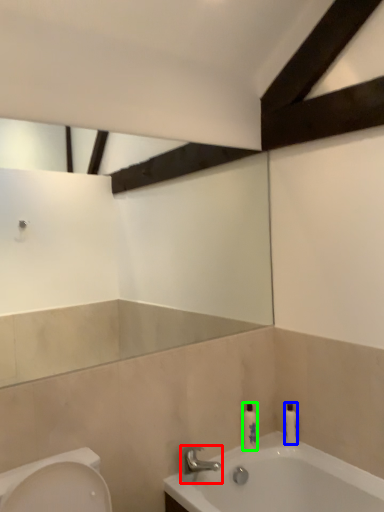
Question: Based on their relative distances, which object is farther from tap (highlighted by a red box)? Choose from toiletry (highlighted by a blue box) and toiletry (highlighted by a green box).

Choices:
 (A) toiletry
 (B) toiletry

Answer: (A)